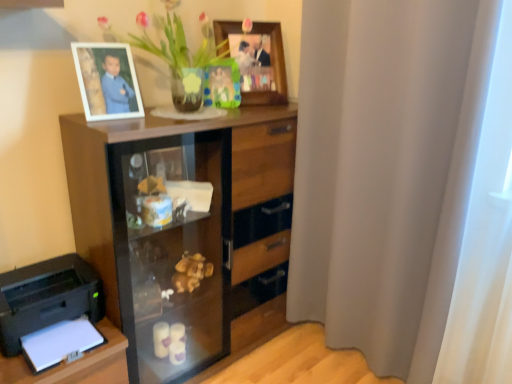
Locate an element on the screen. This screenshot has width=512, height=384. vacant area that is situated to the right of green matte picture frame at upper center, arranged as the 2th picture frame when viewed from the left is located at coordinates (262, 108).